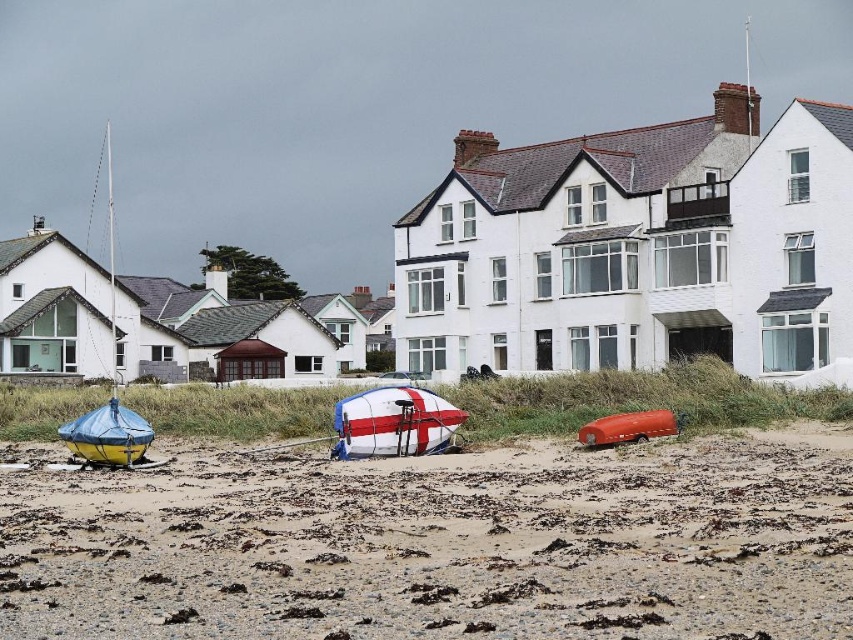
Does brown sandy beach at lower center have a greater height compared to yellow rubber boat at left?

Incorrect, brown sandy beach at lower center's height is not larger of yellow rubber boat at left's.

How distant is brown sandy beach at lower center from yellow rubber boat at left?

brown sandy beach at lower center is 23.00 meters away from yellow rubber boat at left.

Is point (799, 540) positioned behind point (117, 461)?

No, (799, 540) is closer to viewer.

At what (x,y) coordinates should I click in order to perform the action: click on brown sandy beach at lower center. Please return your answer as a coordinate pair (x, y). The width and height of the screenshot is (853, 640). Looking at the image, I should click on (438, 544).

Who is more forward, (416, 403) or (135, 449)?

Positioned in front is point (135, 449).

Does white and red striped boat at center appear under yellow rubber boat at left?

Yes.

Find the location of a particular element. This screenshot has height=640, width=853. white and red striped boat at center is located at coordinates (393, 422).

Who is more forward, (204,561) or (631,428)?

Point (204,561) is more forward.

Who is higher up, brown sandy beach at lower center or matte orange car at center?

matte orange car at center is higher up.

What do you see at coordinates (438, 544) in the screenshot?
I see `brown sandy beach at lower center` at bounding box center [438, 544].

At what (x,y) coordinates should I click in order to perform the action: click on brown sandy beach at lower center. Please return your answer as a coordinate pair (x, y). This screenshot has height=640, width=853. Looking at the image, I should click on (438, 544).